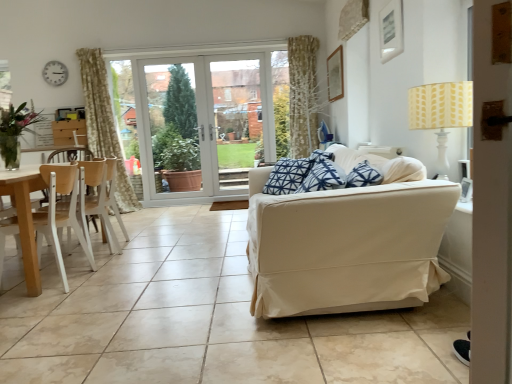
Question: Is beige ceramic tile at center oriented away from transparent glass door at center?

Choices:
 (A) yes
 (B) no

Answer: (B)

Question: Is beige ceramic tile at center completely or partially outside of transparent glass door at center?

Choices:
 (A) no
 (B) yes

Answer: (B)

Question: Considering the relative positions of beige ceramic tile at center and transparent glass door at center in the image provided, is beige ceramic tile at center to the right of transparent glass door at center from the viewer's perspective?

Choices:
 (A) yes
 (B) no

Answer: (B)

Question: Considering the relative positions of beige ceramic tile at center and transparent glass door at center in the image provided, is beige ceramic tile at center behind transparent glass door at center?

Choices:
 (A) yes
 (B) no

Answer: (B)

Question: Does beige ceramic tile at center turn towards transparent glass door at center?

Choices:
 (A) no
 (B) yes

Answer: (A)

Question: In terms of size, does white plastic clock at upper left appear bigger or smaller than blue printed fabric pillow at center?

Choices:
 (A) small
 (B) big

Answer: (A)

Question: From the image's perspective, is white plastic clock at upper left positioned above or below blue printed fabric pillow at center?

Choices:
 (A) below
 (B) above

Answer: (B)

Question: Which is correct: white plastic clock at upper left is inside blue printed fabric pillow at center, or outside of it?

Choices:
 (A) outside
 (B) inside

Answer: (A)

Question: Considering their positions, is white plastic clock at upper left located in front of or behind blue printed fabric pillow at center?

Choices:
 (A) behind
 (B) front

Answer: (A)

Question: Based on their positions, is yellow printed fabric lampshade at upper right located to the left or right of clear glass vase at left?

Choices:
 (A) right
 (B) left

Answer: (A)

Question: Does point (430, 122) appear closer or farther from the camera than point (19, 104)?

Choices:
 (A) closer
 (B) farther

Answer: (A)

Question: From a real-world perspective, relative to clear glass vase at left, is yellow printed fabric lampshade at upper right vertically above or below?

Choices:
 (A) above
 (B) below

Answer: (B)

Question: Is yellow printed fabric lampshade at upper right bigger or smaller than clear glass vase at left?

Choices:
 (A) small
 (B) big

Answer: (A)

Question: In the image, is white plastic clock at upper left positioned in front of or behind beige ceramic tile at center?

Choices:
 (A) behind
 (B) front

Answer: (A)

Question: In the image, is white plastic clock at upper left on the left side or the right side of beige ceramic tile at center?

Choices:
 (A) left
 (B) right

Answer: (A)